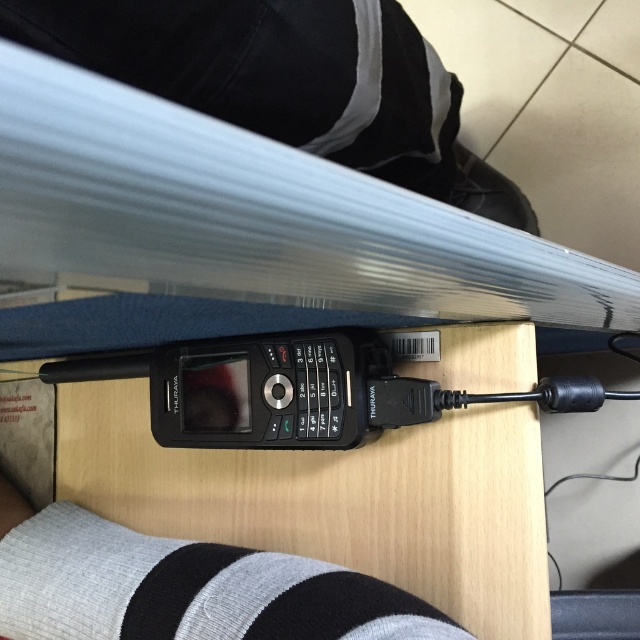
Is black fabric pants at lower center wider than gray knitted sock at lower center?

Correct, the width of black fabric pants at lower center exceeds that of gray knitted sock at lower center.

Between black fabric pants at lower center and gray knitted sock at lower center, which one appears on the right side from the viewer's perspective?

black fabric pants at lower center

Does point (305, 20) come behind point (253, 630)?

That is True.

Identify the location of black fabric pants at lower center. (289, 81).